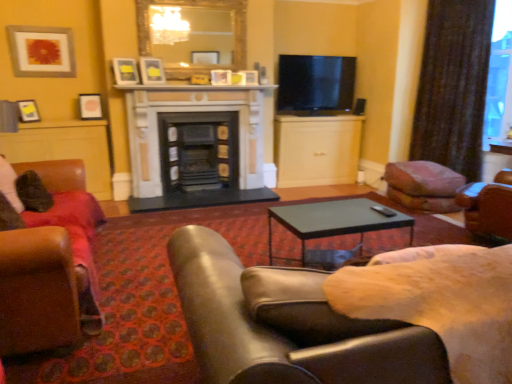
The width and height of the screenshot is (512, 384). What do you see at coordinates (68, 234) in the screenshot?
I see `brown leather chair at left, the first chair from the left` at bounding box center [68, 234].

Measure the distance between point [132,77] and camera.

A distance of 4.58 meters exists between point [132,77] and camera.

Locate an element on the screen. The image size is (512, 384). black glossy tv at upper right is located at coordinates (315, 84).

This screenshot has height=384, width=512. What do you see at coordinates (315, 84) in the screenshot?
I see `black glossy tv at upper right` at bounding box center [315, 84].

The height and width of the screenshot is (384, 512). What are the coordinates of `dark gray textured curtain at right` in the screenshot? It's located at (453, 85).

From a real-world perspective, which object rests below the other?

In real-world perspective, marble fireplace at center, the second fireplace positioned from the left, is lower.

Does marble fireplace at center, the second fireplace positioned from the left, turn towards gold-framed mirror at upper center?

No, marble fireplace at center, the second fireplace positioned from the left, is not facing towards gold-framed mirror at upper center.

Which is more to the left, marble fireplace at center, the second fireplace positioned from the left, or gold-framed mirror at upper center?

Positioned to the left is gold-framed mirror at upper center.

Could you measure the distance between black glossy tv at upper right and matte black picture frame at upper center, which is counted as the third picture frame, starting from the left?

2.31 meters.

Which object is thinner, black glossy tv at upper right or matte black picture frame at upper center, which is counted as the third picture frame, starting from the left?

matte black picture frame at upper center, which is counted as the third picture frame, starting from the left.

From a real-world perspective, which is physically above, black glossy tv at upper right or matte black picture frame at upper center, which is the second picture frame from right to left?

matte black picture frame at upper center, which is the second picture frame from right to left, from a real-world perspective.

Is black glossy tv at upper right behind matte black picture frame at upper center, which is the second picture frame from right to left?

Yes.

What's the angular difference between light wood cabinet at center and dark gray textured curtain at right's facing directions?

The angular difference between light wood cabinet at center and dark gray textured curtain at right is 44.1 degrees.

Is light wood cabinet at center inside the boundaries of dark gray textured curtain at right, or outside?

light wood cabinet at center is located beyond the bounds of dark gray textured curtain at right.

Considering the sizes of objects light wood cabinet at center and dark gray textured curtain at right in the image provided, who is shorter, light wood cabinet at center or dark gray textured curtain at right?

Standing shorter between the two is light wood cabinet at center.

From a real-world perspective, does light wood cabinet at center sit lower than dark gray textured curtain at right?

Yes, from a real-world perspective, light wood cabinet at center is beneath dark gray textured curtain at right.

How far apart are dark gray textured curtain at right and matte black picture frame at upper center, positioned as the 1th picture frame in right-to-left order?

The distance of dark gray textured curtain at right from matte black picture frame at upper center, positioned as the 1th picture frame in right-to-left order, is 3.52 meters.

Is dark gray textured curtain at right oriented away from matte black picture frame at upper center, positioned as the 1th picture frame in right-to-left order?

That's not correct — dark gray textured curtain at right is not looking away from matte black picture frame at upper center, positioned as the 1th picture frame in right-to-left order.

Which object is wider, dark gray textured curtain at right or matte black picture frame at upper center, positioned as the 1th picture frame in right-to-left order?

Wider between the two is dark gray textured curtain at right.

Is dark gray textured curtain at right not inside matte black picture frame at upper center, acting as the 4th picture frame starting from the left?

Absolutely, dark gray textured curtain at right is external to matte black picture frame at upper center, acting as the 4th picture frame starting from the left.

Consider the image. Is light wood cabinet at center inside or outside of matte black picture frame at upper center, acting as the 4th picture frame starting from the left?

light wood cabinet at center is located beyond the bounds of matte black picture frame at upper center, acting as the 4th picture frame starting from the left.

Is matte black picture frame at upper center, acting as the 4th picture frame starting from the left, at the back of light wood cabinet at center?

light wood cabinet at center does not have its back to matte black picture frame at upper center, acting as the 4th picture frame starting from the left.

Based on the photo, can you confirm if light wood cabinet at center is wider than matte black picture frame at upper center, acting as the 4th picture frame starting from the left?

Indeed, light wood cabinet at center has a greater width compared to matte black picture frame at upper center, acting as the 4th picture frame starting from the left.

Considering the positions of objects light wood cabinet at center and matte black picture frame at upper center, positioned as the 1th picture frame in right-to-left order, in the image provided, who is more to the left, light wood cabinet at center or matte black picture frame at upper center, positioned as the 1th picture frame in right-to-left order,?

matte black picture frame at upper center, positioned as the 1th picture frame in right-to-left order, is more to the left.

From the picture: Is matte black picture frame at upper center, acting as the 4th picture frame starting from the left, touching light wood cabinet at center?

No, matte black picture frame at upper center, acting as the 4th picture frame starting from the left, is not touching light wood cabinet at center.

Is point (145, 58) in front of point (327, 142)?

Yes.

Is the depth of matte black picture frame at upper center, positioned as the 1th picture frame in right-to-left order, less than that of light wood cabinet at center?

Yes, it is in front of light wood cabinet at center.

Is matte black picture frame at upper left, positioned as the second picture frame in left-to-right order, positioned far away from matte gray picture frame at upper left, which appears as the first picture frame when viewed from the left?

Actually, matte black picture frame at upper left, positioned as the second picture frame in left-to-right order, and matte gray picture frame at upper left, which appears as the first picture frame when viewed from the left, are a little close together.

From a real-world perspective, which is physically above, matte black picture frame at upper left, acting as the third picture frame starting from the right, or matte gray picture frame at upper left, the 4th picture frame viewed from the right?

matte gray picture frame at upper left, the 4th picture frame viewed from the right, from a real-world perspective.

Considering the positions of objects matte black picture frame at upper left, acting as the third picture frame starting from the right, and matte gray picture frame at upper left, the 4th picture frame viewed from the right, in the image provided, who is behind, matte black picture frame at upper left, acting as the third picture frame starting from the right, or matte gray picture frame at upper left, the 4th picture frame viewed from the right,?

matte black picture frame at upper left, acting as the third picture frame starting from the right, is further away from the camera.

Is point (101, 108) positioned after point (12, 32)?

Yes, point (101, 108) is behind point (12, 32).

The height and width of the screenshot is (384, 512). I want to click on mirror on the left of marble fireplace at center, the second fireplace positioned from the left, so click(193, 34).

Identify the location of television lying behind the matte black picture frame at upper center, which is the second picture frame from right to left. (315, 84).

When comparing their distances from matte black picture frame at upper left, positioned as the second picture frame in left-to-right order, does matte gray picture frame at upper left, which appears as the first picture frame when viewed from the left, or light wood cabinet at center seem further?

The object further to matte black picture frame at upper left, positioned as the second picture frame in left-to-right order, is light wood cabinet at center.

Estimate the real-world distances between objects in this image. Which object is further from brown leather chair at center, which ranks as the first chair in right-to-left order, black glossy tv at upper right or black matte fireplace at center, the first fireplace positioned from the left?

black glossy tv at upper right is positioned further to the anchor brown leather chair at center, which ranks as the first chair in right-to-left order.

Estimate the real-world distances between objects in this image. Which object is further from dark gray textured curtain at right, brown leather chair at center, which ranks as the first chair in right-to-left order, or brown leather chair at left, acting as the second chair starting from the right?

brown leather chair at center, which ranks as the first chair in right-to-left order, is positioned further to the anchor dark gray textured curtain at right.

Estimate the real-world distances between objects in this image. Which object is further from black matte fireplace at center, which is the second fireplace in right-to-left order, matte black picture frame at upper left, positioned as the second picture frame in left-to-right order, or dark gray textured curtain at right?

dark gray textured curtain at right is positioned further to the anchor black matte fireplace at center, which is the second fireplace in right-to-left order.

Which object lies further to the anchor point light wood cabinet at center, marble fireplace at center, which appears as the 1th fireplace when viewed from the right, or brown leather chair at center, placed as the 2th chair when sorted from left to right?

Among the two, brown leather chair at center, placed as the 2th chair when sorted from left to right, is located further to light wood cabinet at center.

Estimate the real-world distances between objects in this image. Which object is closer to black glossy tv at upper right, matte black picture frame at upper center, which is counted as the third picture frame, starting from the left, or brown leather chair at center, placed as the 2th chair when sorted from left to right?

Among the two, matte black picture frame at upper center, which is counted as the third picture frame, starting from the left, is located nearer to black glossy tv at upper right.

Looking at the image, which one is located further to matte gray picture frame at upper left, which appears as the first picture frame when viewed from the left, light wood cabinet at center or black glossy tv at upper right?

light wood cabinet at center is further to matte gray picture frame at upper left, which appears as the first picture frame when viewed from the left.

Looking at the image, which one is located closer to matte gray picture frame at upper left, which appears as the first picture frame when viewed from the left, matte black coffee table at center or matte black picture frame at upper left, positioned as the second picture frame in left-to-right order?

matte black picture frame at upper left, positioned as the second picture frame in left-to-right order, is positioned closer to the anchor matte gray picture frame at upper left, which appears as the first picture frame when viewed from the left.

This screenshot has height=384, width=512. I want to click on coffee table between brown leather chair at center, placed as the 2th chair when sorted from left to right, and gold-framed mirror at upper center, along the z-axis, so (x=336, y=220).

Where is `picture frame located between brown leather chair at center, which ranks as the first chair in right-to-left order, and matte black picture frame at upper center, acting as the 4th picture frame starting from the left, in the depth direction`? This screenshot has height=384, width=512. picture frame located between brown leather chair at center, which ranks as the first chair in right-to-left order, and matte black picture frame at upper center, acting as the 4th picture frame starting from the left, in the depth direction is located at coordinates (x=125, y=71).

Locate an element on the screen. This screenshot has height=384, width=512. fireplace between brown leather chair at center, placed as the 2th chair when sorted from left to right, and black matte fireplace at center, the first fireplace positioned from the left, from front to back is located at coordinates (196, 146).

Image resolution: width=512 pixels, height=384 pixels. In order to click on chair between brown leather chair at center, placed as the 2th chair when sorted from left to right, and light wood cabinet at center from front to back in this screenshot , I will do `click(68, 234)`.